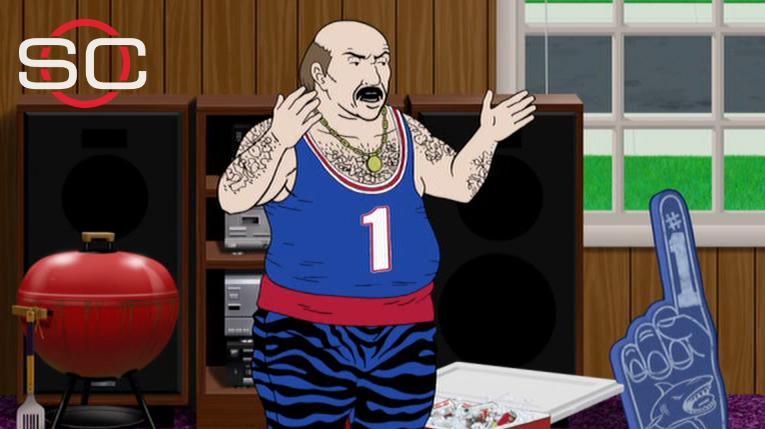
Locate an element on the screen. speaker is located at coordinates (526, 255), (128, 199).